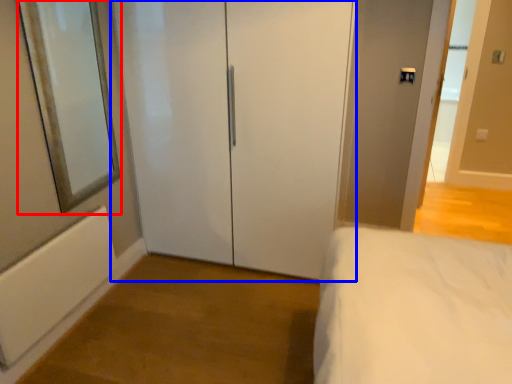
Question: Which object appears closest to the camera in this image, mirror (highlighted by a red box) or door (highlighted by a blue box)?

Choices:
 (A) mirror
 (B) door

Answer: (A)